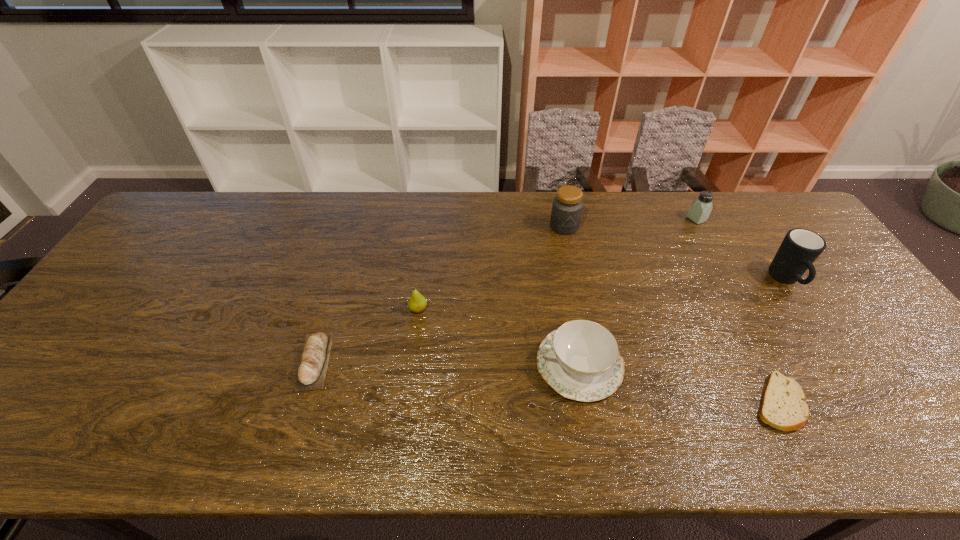
At what (x,y) coordinates should I click in order to perform the action: click on the rightmost object. Please return your answer as a coordinate pair (x, y). Looking at the image, I should click on (800, 248).

This screenshot has height=540, width=960. I want to click on mug, so click(x=800, y=248).

In order to click on jar in this screenshot , I will do `click(567, 206)`.

Identify the location of saltshaker. (700, 209).

You are a GUI agent. You are given a task and a screenshot of the screen. Output one action in this format:
    pyautogui.click(x=<x>, y=<y>)
    Task: Click on the fourth nearest object
    
    Given the screenshot: What is the action you would take?
    pyautogui.click(x=417, y=303)

Image resolution: width=960 pixels, height=540 pixels. I want to click on pear, so click(417, 303).

Locate an element on the screen. chinaware is located at coordinates (580, 360).

At what (x,y) coordinates should I click in order to perform the action: click on the sixth tallest object. Please return your answer as a coordinate pair (x, y). The height and width of the screenshot is (540, 960). Looking at the image, I should click on (312, 371).

Where is `the leftmost object`? This screenshot has height=540, width=960. the leftmost object is located at coordinates (312, 371).

At what (x,y) coordinates should I click in order to perform the action: click on the right pita bread. Please return your answer as a coordinate pair (x, y). This screenshot has height=540, width=960. Looking at the image, I should click on (783, 406).